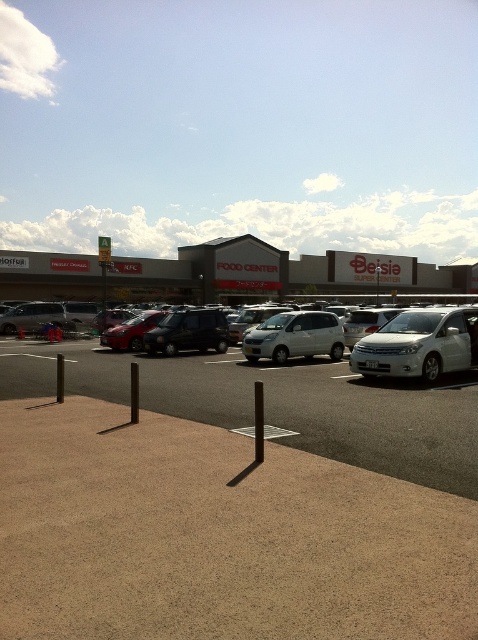
Does white metallic car at right have a smaller size compared to shiny black suv at center?

Correct, white metallic car at right occupies less space than shiny black suv at center.

Locate an element on the screen. white metallic car at right is located at coordinates (420, 344).

Between silver metallic sedan at center and metallic red car at center, which one appears on the right side from the viewer's perspective?

silver metallic sedan at center

Is silver metallic sedan at center smaller than metallic red car at center?

Actually, silver metallic sedan at center might be larger than metallic red car at center.

The image size is (478, 640). In order to click on silver metallic sedan at center in this screenshot , I will do `click(159, 371)`.

Between silver metallic sedan at center and shiny black suv at center, which one has less height?

Standing shorter between the two is shiny black suv at center.

Can you confirm if silver metallic sedan at center is positioned above shiny black suv at center?

Incorrect, silver metallic sedan at center is not positioned above shiny black suv at center.

Find the location of a particular element. The width and height of the screenshot is (478, 640). silver metallic sedan at center is located at coordinates (159, 371).